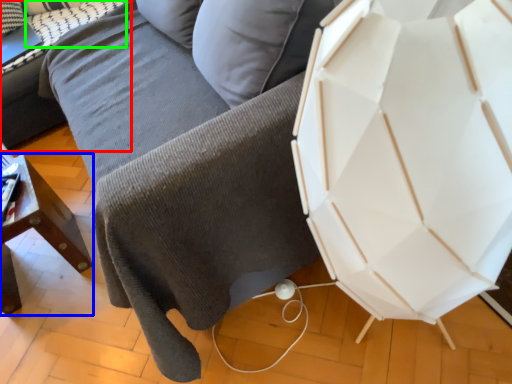
Question: Which object is the farthest from table (highlighted by a red box)? Choose among these: furniture (highlighted by a blue box) or pillow (highlighted by a green box).

Choices:
 (A) furniture
 (B) pillow

Answer: (A)